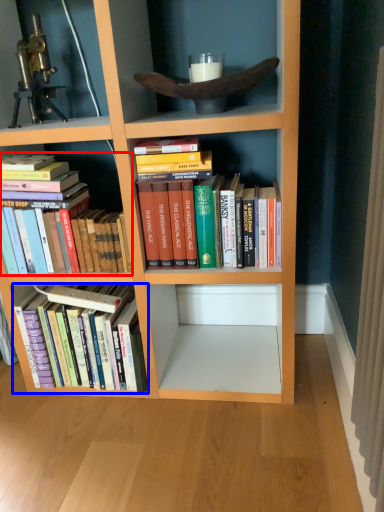
Question: Which point is closer to the camera, book (highlighted by a red box) or book (highlighted by a blue box)?

Choices:
 (A) book
 (B) book

Answer: (A)